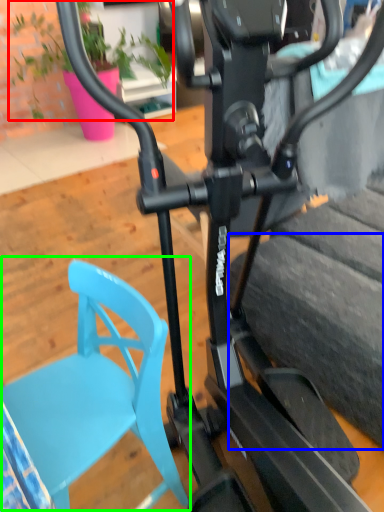
Question: Which is farther away from plant (highlighted by a red box)? tire (highlighted by a blue box) or swivel chair (highlighted by a green box)?

Choices:
 (A) tire
 (B) swivel chair

Answer: (B)